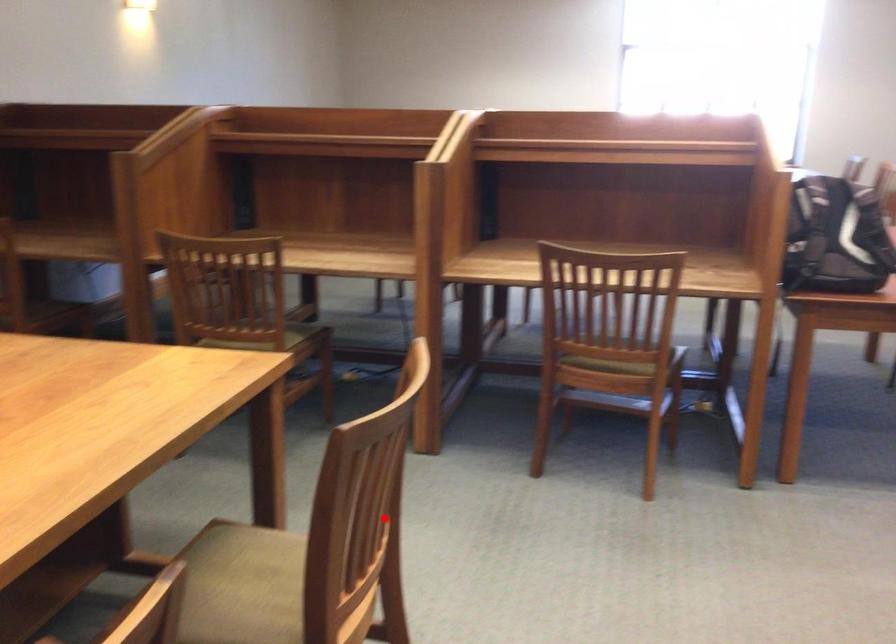
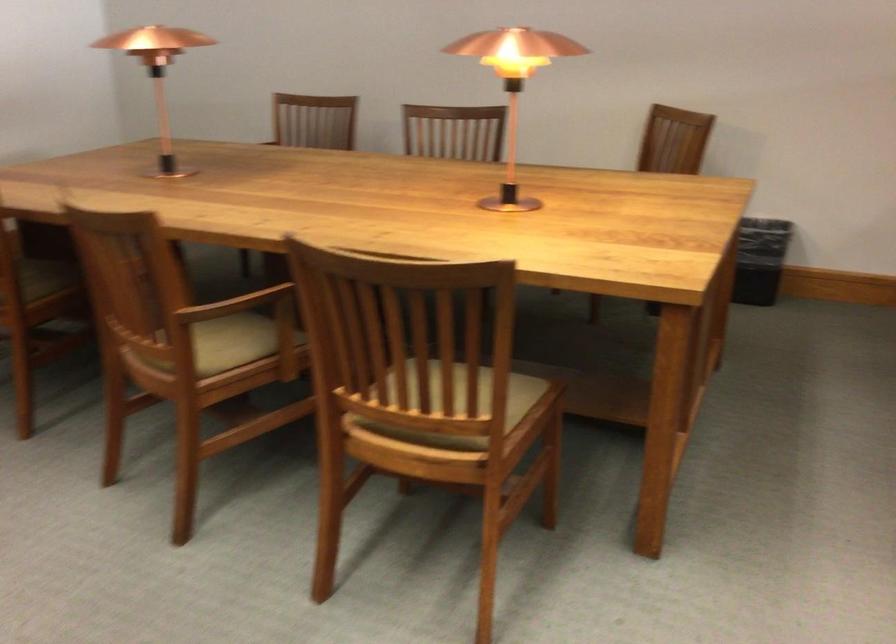
In the second image, find the point that corresponds to the highlighted location in the first image.

(460, 404)